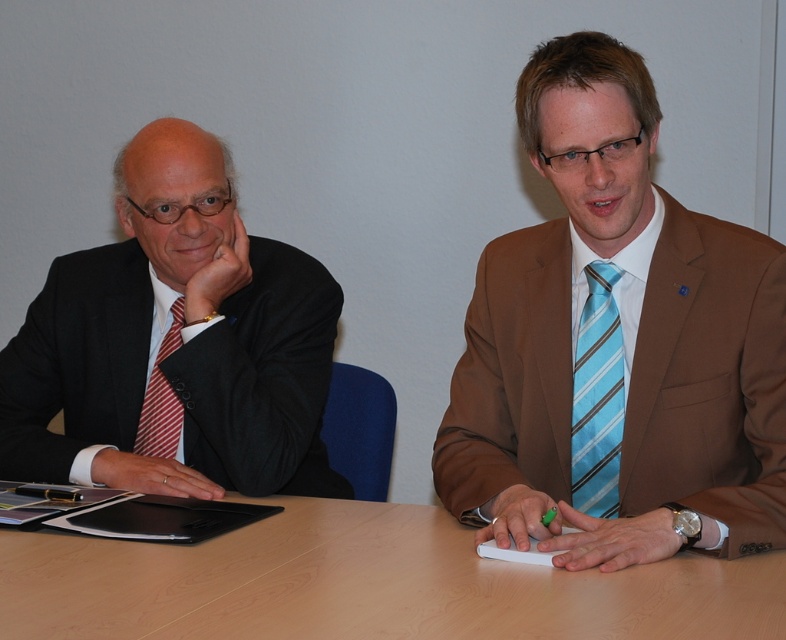
Question: Does brown silk suit at center appear over matte black suit at left?

Choices:
 (A) yes
 (B) no

Answer: (A)

Question: Estimate the real-world distances between objects in this image. Which object is closer to the matte black suit at left?

Choices:
 (A) light brown wood table at center
 (B) red striped tie at left
 (C) blue striped tie at right

Answer: (B)

Question: Is matte black suit at left bigger than red striped tie at left?

Choices:
 (A) no
 (B) yes

Answer: (B)

Question: Which point is farther from the camera taking this photo?

Choices:
 (A) (597, 305)
 (B) (634, 154)
 (C) (166, 419)

Answer: (C)

Question: In this image, where is light brown wood table at center located relative to red striped tie at left?

Choices:
 (A) left
 (B) right

Answer: (B)

Question: Which object is closer to the camera taking this photo?

Choices:
 (A) brown silk suit at center
 (B) light brown wood table at center

Answer: (B)